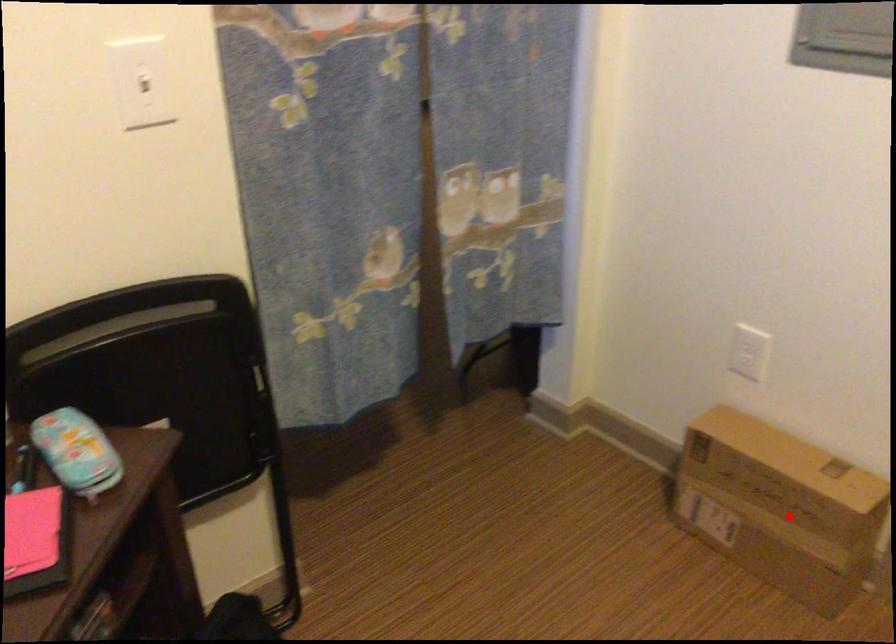
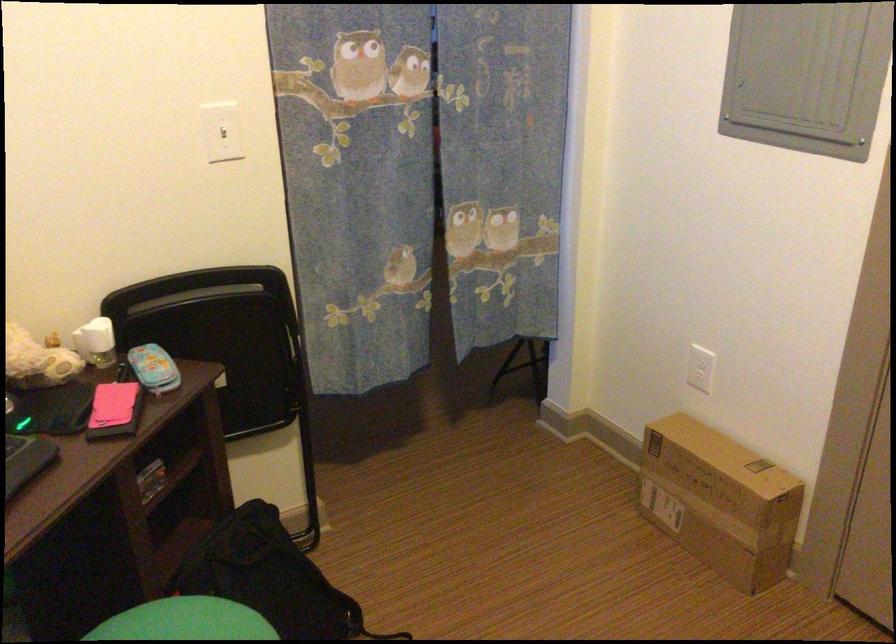
The point at the highlighted location is marked in the first image. Where is the corresponding point in the second image?

(719, 500)